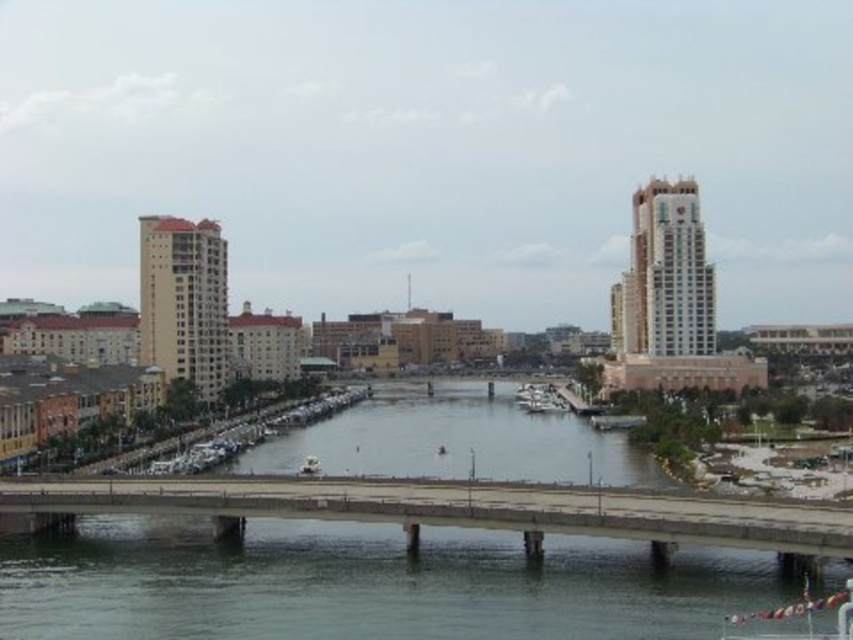
You are a photographer planning to capture a wide shot of the cityscape with both the concrete bridge at center and the white glossy boat at center. Given that the bridge is larger, which object would you need to position closer to the camera to ensure both appear balanced in size in the photo?

To balance the sizes of the concrete bridge at center and the white glossy boat at center in the photo, you should position the white glossy boat at center closer to the camera since the concrete bridge at center is naturally larger.

You are a photographer planning to capture a shot of the concrete bridge at center and the white glossy boat at center from the left bank. Which object should you position closer to the left edge of your camera frame?

The concrete bridge at center should be positioned closer to the left edge of your camera frame because it is located to the left of the white glossy boat at center.

You are a drone operator tasked with capturing aerial footage of the city. Your mission requires you to fly your drone from the point marked by point (457, 508) to the nearest building on the left side of the river. Can you determine if the drone will have enough clearance to pass under the bridge? Please consider the height of the bridge and the drone path.

The point (457, 508) marks the concrete bridge at center. Since the bridge spans across the river, the drone flying from this point to the nearest building on the left side would need to navigate under the bridge. However, the bridge has multiple lanes and sturdy concrete pillars, which may obstruct the path. Without specific clearance measurements, it is uncertain if the drone can safely pass under the bridge. Check local regulations or obtain clearance data before proceeding.